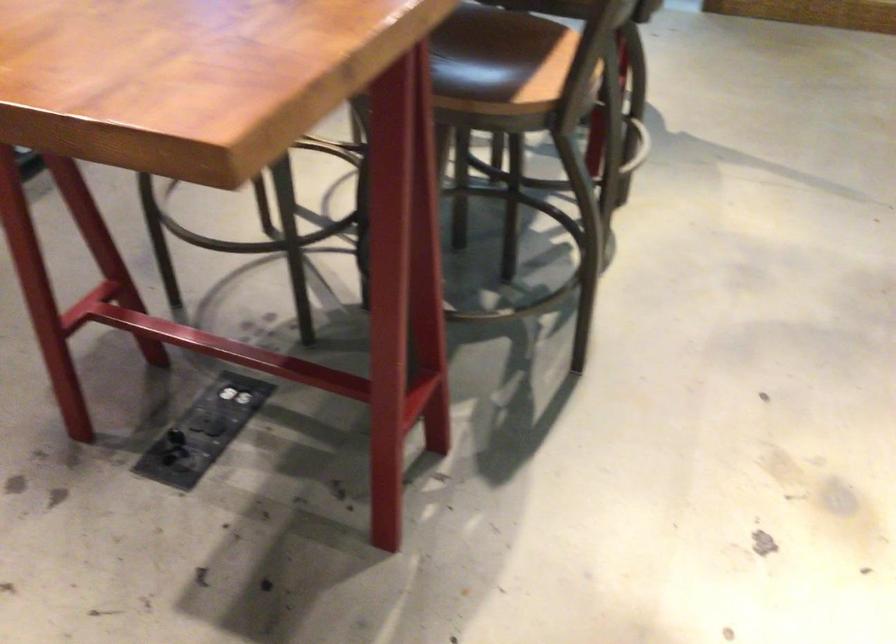
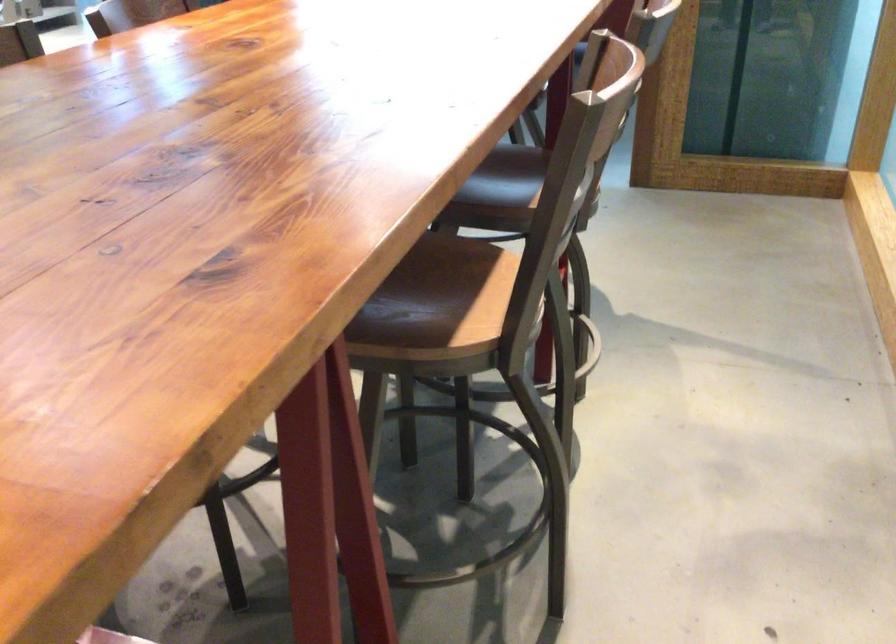
Question: Which direction would the cameraman need to move to produce the second image? Reply with the corresponding letter.

Choices:
 (A) Left
 (B) Right
 (C) Forward
 (D) Backward

Answer: (C)